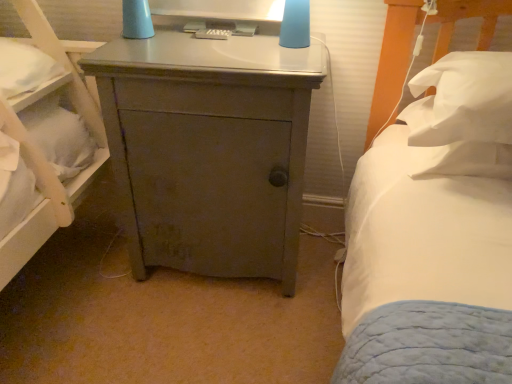
Question: Does matte blue lampshade at upper center have a greater height compared to white soft pillow at right, which ranks as the second pillow in top-to-bottom order?

Choices:
 (A) no
 (B) yes

Answer: (B)

Question: Does matte blue lampshade at upper center lie behind white soft pillow at right, marked as the first pillow in a bottom-to-top arrangement?

Choices:
 (A) no
 (B) yes

Answer: (B)

Question: Would you consider matte blue lampshade at upper center to be distant from white soft pillow at right, which ranks as the second pillow in top-to-bottom order?

Choices:
 (A) yes
 (B) no

Answer: (B)

Question: Considering the relative sizes of matte blue lampshade at upper center and white soft pillow at right, marked as the first pillow in a bottom-to-top arrangement, in the image provided, is matte blue lampshade at upper center thinner than white soft pillow at right, marked as the first pillow in a bottom-to-top arrangement,?

Choices:
 (A) no
 (B) yes

Answer: (B)

Question: Does matte blue lampshade at upper center contain white soft pillow at right, which ranks as the second pillow in top-to-bottom order?

Choices:
 (A) yes
 (B) no

Answer: (B)

Question: In terms of width, does white soft pillow at right, positioned as the second pillow in bottom-to-top order, look wider or thinner when compared to matte blue lampshade at upper center?

Choices:
 (A) thin
 (B) wide

Answer: (B)

Question: Is point (429, 127) positioned closer to the camera than point (302, 26)?

Choices:
 (A) farther
 (B) closer

Answer: (B)

Question: Is white soft pillow at right, placed as the first pillow when sorted from top to bottom, bigger or smaller than matte blue lampshade at upper center?

Choices:
 (A) big
 (B) small

Answer: (A)

Question: In the image, is white soft pillow at right, positioned as the second pillow in bottom-to-top order, on the left side or the right side of matte blue lampshade at upper center?

Choices:
 (A) right
 (B) left

Answer: (A)

Question: From a real-world perspective, relative to matte gray cabinet at center, is matte blue lampshade at upper center vertically above or below?

Choices:
 (A) below
 (B) above

Answer: (B)

Question: Is matte blue lampshade at upper center taller or shorter than matte gray cabinet at center?

Choices:
 (A) short
 (B) tall

Answer: (A)

Question: Based on their positions, is matte blue lampshade at upper center located to the left or right of matte gray cabinet at center?

Choices:
 (A) right
 (B) left

Answer: (A)

Question: From the image's perspective, relative to matte gray cabinet at center, is matte blue lampshade at upper center above or below?

Choices:
 (A) below
 (B) above

Answer: (B)

Question: Considering the positions of point (229, 3) and point (429, 67), is point (229, 3) closer or farther from the camera than point (429, 67)?

Choices:
 (A) closer
 (B) farther

Answer: (B)

Question: Looking at their shapes, would you say matte plastic remote control at upper center is wider or thinner than white soft pillow at right, positioned as the second pillow in bottom-to-top order?

Choices:
 (A) wide
 (B) thin

Answer: (B)